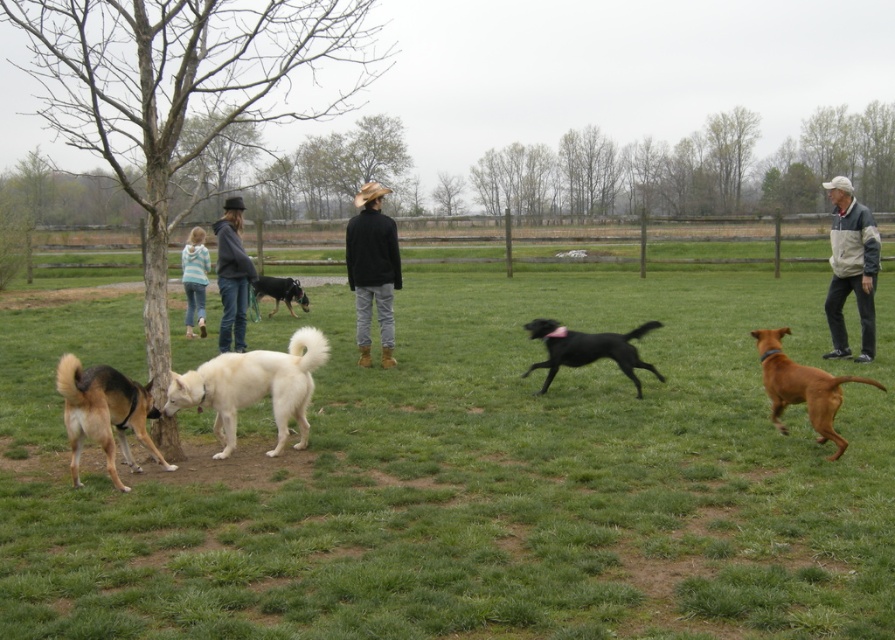
Is white fleece jacket at right positioned at the back of black glossy dog at center?

No.

Does white fleece jacket at right appear on the right side of black glossy dog at center?

Correct, you'll find white fleece jacket at right to the right of black glossy dog at center.

Who is more distant from viewer, (857, 304) or (301, 301)?

The point (301, 301) is behind.

I want to click on white fleece jacket at right, so click(851, 268).

Does white fleece jacket at right appear on the left side of striped sweater at left?

In fact, white fleece jacket at right is to the right of striped sweater at left.

Is white fleece jacket at right below striped sweater at left?

Yes.

Does point (824, 182) come farther from viewer compared to point (192, 243)?

No, it is in front of (192, 243).

At what (x,y) coordinates should I click in order to perform the action: click on white fleece jacket at right. Please return your answer as a coordinate pair (x, y). Looking at the image, I should click on (851, 268).

Consider the image. Between green grass at center and brown glossy dog at right, which one has less height?

With less height is brown glossy dog at right.

Where is `green grass at center`? The height and width of the screenshot is (640, 895). green grass at center is located at coordinates (476, 477).

Is point (888, 371) farther from camera compared to point (780, 380)?

Yes, it is.

This screenshot has height=640, width=895. Identify the location of green grass at center. (476, 477).